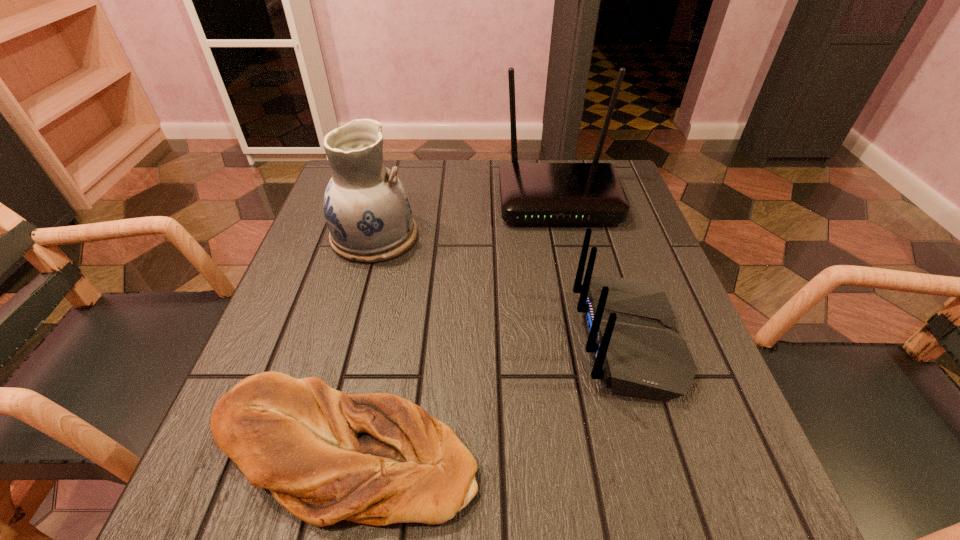
Where is `the taller router`? The height and width of the screenshot is (540, 960). the taller router is located at coordinates (530, 192).

The width and height of the screenshot is (960, 540). I want to click on pottery, so click(x=366, y=207).

Where is `the shorter router`? The height and width of the screenshot is (540, 960). the shorter router is located at coordinates (630, 326).

The height and width of the screenshot is (540, 960). I want to click on the third tallest object, so click(630, 326).

Identify the location of bread. This screenshot has height=540, width=960. (377, 459).

You are a GUI agent. You are given a task and a screenshot of the screen. Output one action in this format:
    pyautogui.click(x=<x>, y=<y>)
    Task: Click on the vacant space positioned on the front-facing side of the farther router
    The height and width of the screenshot is (540, 960).
    Given the screenshot: What is the action you would take?
    pyautogui.click(x=567, y=243)

The width and height of the screenshot is (960, 540). I want to click on free space located on the front of the pottery, so click(x=356, y=302).

The image size is (960, 540). I want to click on vacant position located on the back of the shorter router, so click(546, 340).

Identify the location of blank space located 0.260m on the back of the shorter router. (437, 340).

The height and width of the screenshot is (540, 960). I want to click on vacant area situated on the back of the shorter router, so click(524, 340).